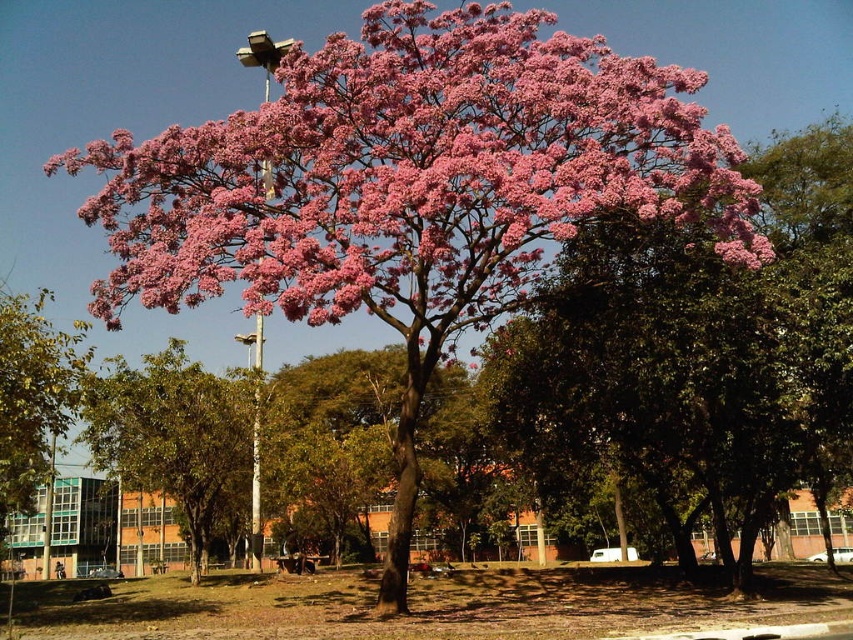
Question: Among these objects, which one is farthest from the camera?

Choices:
 (A) green leafy tree at lower left
 (B) pink matte flower at upper center

Answer: (A)

Question: Is pink matte flower at upper center bigger than green leafy tree at lower left?

Choices:
 (A) no
 (B) yes

Answer: (A)

Question: Can you confirm if pink matte flower at upper center is thinner than green leafy tree at lower left?

Choices:
 (A) no
 (B) yes

Answer: (B)

Question: Among these objects, which one is farthest from the camera?

Choices:
 (A) pink matte flower at upper center
 (B) green leafy tree at lower left

Answer: (B)

Question: Which of the following is the closest to the observer?

Choices:
 (A) (39, 401)
 (B) (206, 208)

Answer: (A)

Question: Is pink matte flower at upper center smaller than green leafy tree at lower left?

Choices:
 (A) yes
 (B) no

Answer: (A)